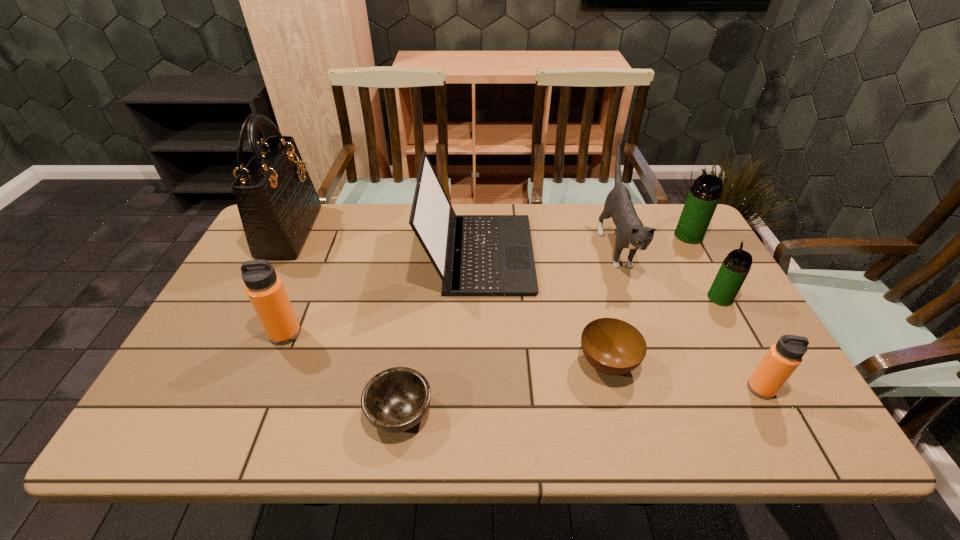
Where is `vacant space at the right edge of the desktop`? This screenshot has height=540, width=960. vacant space at the right edge of the desktop is located at coordinates (701, 272).

Where is `free spot between the shortest object and the smaller green thermos bottle`? The height and width of the screenshot is (540, 960). free spot between the shortest object and the smaller green thermos bottle is located at coordinates (560, 355).

You are a GUI agent. You are given a task and a screenshot of the screen. Output one action in this format:
    pyautogui.click(x=<x>, y=<y>)
    Task: Click on the empty space between the farthest thermos bottle and the right orange thermos bottle
    The width and height of the screenshot is (960, 540).
    Given the screenshot: What is the action you would take?
    pyautogui.click(x=725, y=312)

In order to click on unoccupied position between the nearest thermos bottle and the shortest object in this screenshot , I will do `click(581, 401)`.

Find the location of a particular element. Image resolution: width=960 pixels, height=540 pixels. vacant point located between the bigger green thermos bottle and the smaller green thermos bottle is located at coordinates (705, 267).

In order to click on blank region between the cat and the gray laptop in this screenshot , I will do `click(547, 249)`.

Find the location of a particular element. This screenshot has height=540, width=960. free point between the right orange thermos bottle and the bigger orange thermos bottle is located at coordinates 523,361.

The image size is (960, 540). Find the location of `free space between the farther green thermos bottle and the fourth object from right to left`. free space between the farther green thermos bottle and the fourth object from right to left is located at coordinates coord(652,240).

Identify the location of vacant area that lies between the laptop and the third farthest thermos bottle. This screenshot has height=540, width=960. pos(382,294).

Locate which object ranks sixth in proximity to the cat. Please provide its 2D coordinates. Your answer should be formatted as a tuple, i.e. [(x, y)], where the tuple contains the x and y coordinates of a point satisfying the conditions above.

[(396, 399)]